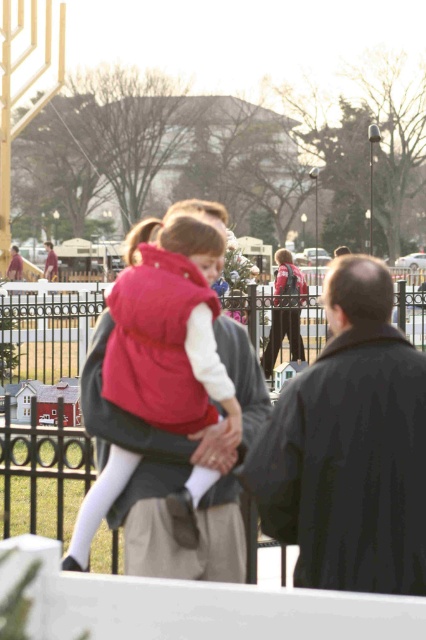
You are a photographer trying to capture the perfect shot of the matte red vest at center. Based on the coordinates provided, where should you position your camera to ensure the vest is centered in your frame?

The matte red vest at center is located at coordinates point [169,330], so positioning the camera directly facing that point will center the vest in the frame.

You are a photographer trying to take a picture of the matte red vest at center and the black iron fence at center. From your current position, which object is closer to you?

The black iron fence at center is closer to you because the matte red vest at center is behind it.